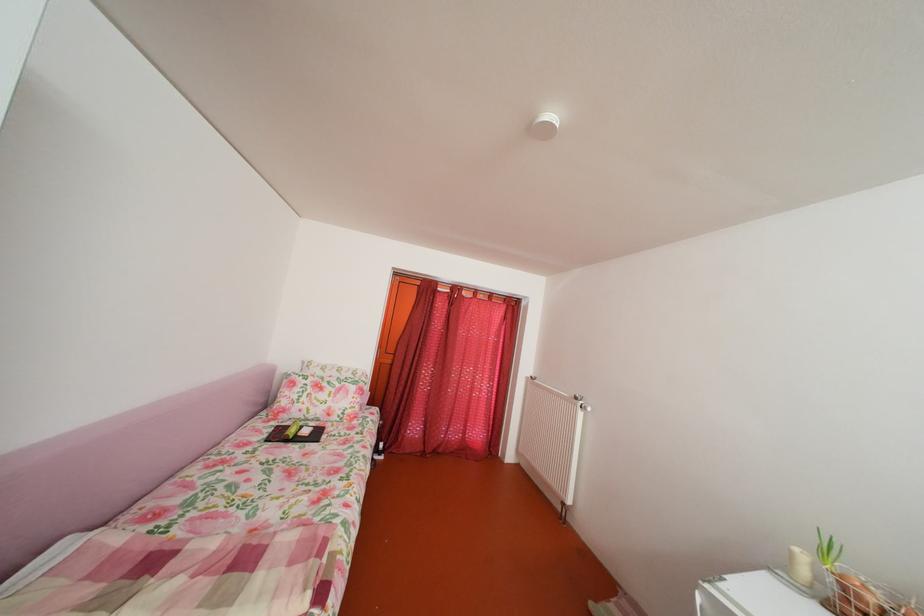
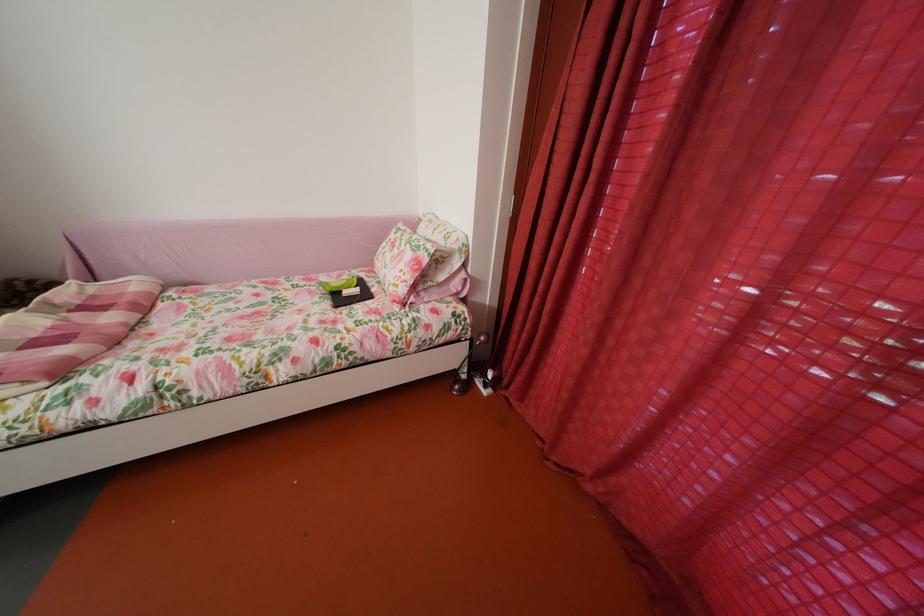
The point at (363, 394) is marked in the first image. Where is the corresponding point in the second image?

(419, 262)